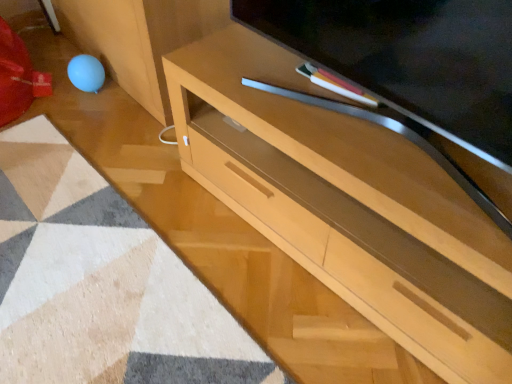
Identify the location of free location above beige textured mat at lower left (from a real-world perspective). This screenshot has width=512, height=384. (78, 258).